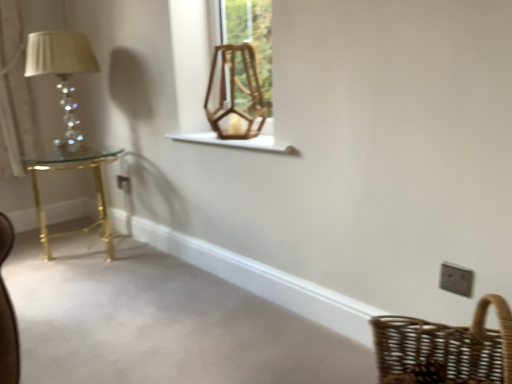
Describe the element at coordinates (95, 184) in the screenshot. I see `gold metallic table at left` at that location.

Measure the distance between gold metallic table at left and camera.

The depth of gold metallic table at left is 2.24 meters.

This screenshot has height=384, width=512. I want to click on white wooden window sill at center, so click(237, 142).

Measure the distance between white plastic/light switch at lower right and camera.

white plastic/light switch at lower right is 1.19 meters away from camera.

Identify the location of white plastic/light switch at lower right. (456, 279).

Image resolution: width=512 pixels, height=384 pixels. I want to click on gold metallic table at left, so click(95, 184).

Considering the points (262, 136) and (260, 101), which point is behind, point (262, 136) or point (260, 101)?

Point (260, 101)

Consider the image. Is white wooden window sill at center inside or outside of wooden swivel chair at upper center?

white wooden window sill at center is located beyond the bounds of wooden swivel chair at upper center.

From the picture: From a real-world perspective, is white wooden window sill at center physically below wooden swivel chair at upper center?

Indeed, from a real-world perspective, white wooden window sill at center is positioned beneath wooden swivel chair at upper center.

From the image's perspective, which one is positioned higher, white wooden window sill at center or wooden swivel chair at upper center?

wooden swivel chair at upper center appears higher in the image.

Between gold metallic table at left and matte glass table lamp at left, which one has less height?

gold metallic table at left.

In the scene shown: Is gold metallic table at left wider or thinner than matte glass table lamp at left?

Considering their sizes, gold metallic table at left looks slimmer than matte glass table lamp at left.

From the image's perspective, is gold metallic table at left positioned above or below matte glass table lamp at left?

From the image's perspective, gold metallic table at left appears below matte glass table lamp at left.

Is point (109, 258) farther from viewer compared to point (211, 140)?

Yes, point (109, 258) is behind point (211, 140).

Which is more to the right, gold metallic table at left or white wooden window sill at center?

white wooden window sill at center is more to the right.

Is gold metallic table at left located outside white wooden window sill at center?

gold metallic table at left lies outside white wooden window sill at center's area.

From a real-world perspective, does gold metallic table at left stand above white wooden window sill at center?

No, from a real-world perspective, gold metallic table at left is not on top of white wooden window sill at center.

From the image's perspective, does white wooden window sill at center appear lower than woven brown basket at lower right?

No, from the image's perspective, white wooden window sill at center is not beneath woven brown basket at lower right.

Considering the sizes of objects white wooden window sill at center and woven brown basket at lower right in the image provided, who is shorter, white wooden window sill at center or woven brown basket at lower right?

Standing shorter between the two is white wooden window sill at center.

Does white wooden window sill at center have a lesser width compared to woven brown basket at lower right?

Indeed, white wooden window sill at center has a lesser width compared to woven brown basket at lower right.

In the scene shown: From a real-world perspective, is white wooden window sill at center positioned above or below woven brown basket at lower right?

white wooden window sill at center is above woven brown basket at lower right.

In the scene shown: Is white plastic/light switch at lower right spatially inside wooden swivel chair at upper center, or outside of it?

white plastic/light switch at lower right is not enclosed by wooden swivel chair at upper center.

From the image's perspective, is white plastic/light switch at lower right over wooden swivel chair at upper center?

No, from the image's perspective, white plastic/light switch at lower right is not over wooden swivel chair at upper center.

Who is taller, white plastic/light switch at lower right or wooden swivel chair at upper center?

Standing taller between the two is wooden swivel chair at upper center.

Is point (465, 278) positioned behind point (206, 102)?

No, (465, 278) is closer to viewer.

Is gold metallic table at left taller or shorter than white plastic/light switch at lower right?

In the image, gold metallic table at left appears to be taller than white plastic/light switch at lower right.

Considering the relative positions of gold metallic table at left and white plastic/light switch at lower right in the image provided, is gold metallic table at left to the left of white plastic/light switch at lower right from the viewer's perspective?

Correct, you'll find gold metallic table at left to the left of white plastic/light switch at lower right.

This screenshot has width=512, height=384. I want to click on light switch on the right of gold metallic table at left, so [x=456, y=279].

Considering the sizes of objects matte glass table lamp at left and woven brown basket at lower right in the image provided, who is taller, matte glass table lamp at left or woven brown basket at lower right?

matte glass table lamp at left.

Where is `table lamp above the woven brown basket at lower right (from the image's perspective)`? table lamp above the woven brown basket at lower right (from the image's perspective) is located at coordinates (62, 73).

Would you say matte glass table lamp at left is inside or outside woven brown basket at lower right?

The correct answer is: outside.

From the image's perspective, which one is positioned higher, matte glass table lamp at left or woven brown basket at lower right?

matte glass table lamp at left.

Find the location of a particular element. This screenshot has height=384, width=512. window sill in front of the wooden swivel chair at upper center is located at coordinates (237, 142).

This screenshot has height=384, width=512. Identify the location of table lamp above the gold metallic table at left (from the image's perspective). (62, 73).

Based on their spatial positions, is gold metallic table at left or woven brown basket at lower right further from white wooden window sill at center?

Among the two, gold metallic table at left is located further to white wooden window sill at center.

Looking at the image, which one is located further to wooden swivel chair at upper center, white wooden window sill at center or gold metallic table at left?

gold metallic table at left is positioned further to the anchor wooden swivel chair at upper center.

Looking at the image, which one is located closer to wooden swivel chair at upper center, woven brown basket at lower right or white plastic/light switch at lower right?

woven brown basket at lower right lies closer to wooden swivel chair at upper center than the other object.

Based on their spatial positions, is matte glass table lamp at left or woven brown basket at lower right closer to white plastic/light switch at lower right?

woven brown basket at lower right.

Estimate the real-world distances between objects in this image. Which object is further from wooden swivel chair at upper center, white plastic/light switch at lower right or white wooden window sill at center?

Among the two, white plastic/light switch at lower right is located further to wooden swivel chair at upper center.

From the picture: Estimate the real-world distances between objects in this image. Which object is further from gold metallic table at left, white plastic/light switch at lower right or woven brown basket at lower right?

white plastic/light switch at lower right.

Considering their positions, is gold metallic table at left positioned further to white plastic/light switch at lower right than woven brown basket at lower right?

gold metallic table at left is positioned further to the anchor white plastic/light switch at lower right.

From the image, which object appears to be nearer to matte glass table lamp at left, wooden swivel chair at upper center or woven brown basket at lower right?

wooden swivel chair at upper center is positioned closer to the anchor matte glass table lamp at left.

In order to click on swivel chair located between woven brown basket at lower right and gold metallic table at left in the depth direction in this screenshot , I will do `click(234, 93)`.

Where is `window sill between wooden swivel chair at upper center and white plastic/light switch at lower right in the horizontal direction`? The image size is (512, 384). window sill between wooden swivel chair at upper center and white plastic/light switch at lower right in the horizontal direction is located at coordinates (237, 142).

Find the location of a particular element. The width and height of the screenshot is (512, 384). light switch located between woven brown basket at lower right and white wooden window sill at center in the depth direction is located at coordinates (456, 279).

The image size is (512, 384). Find the location of `basket between matte glass table lamp at left and white plastic/light switch at lower right from left to right`. basket between matte glass table lamp at left and white plastic/light switch at lower right from left to right is located at coordinates (444, 349).